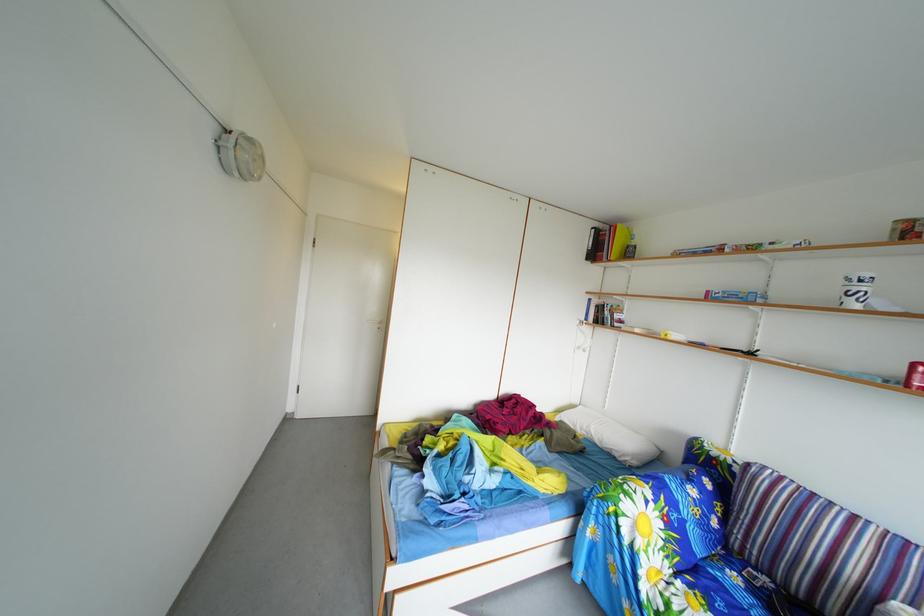
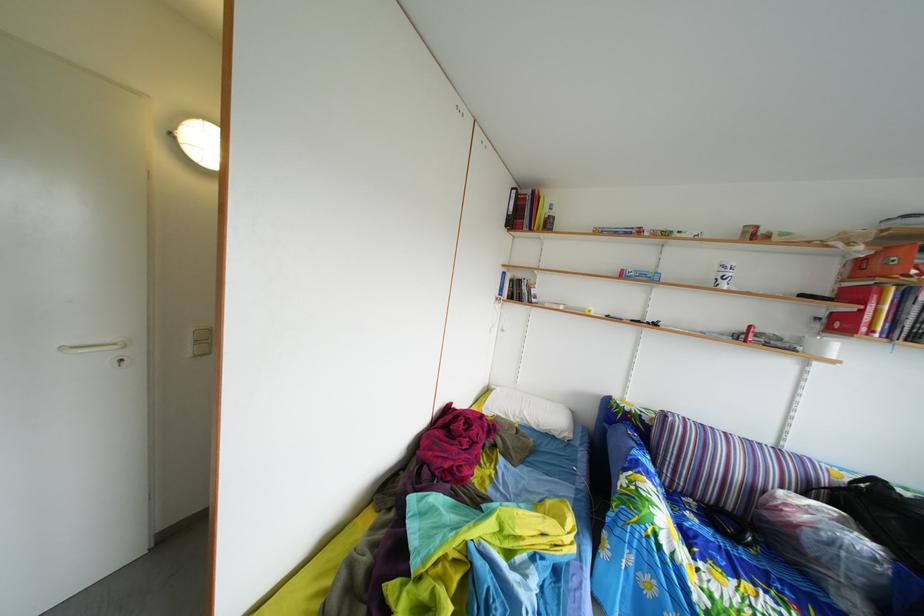
Find the pixel in the second image that matches the point at 612,451 in the first image.

(549, 434)